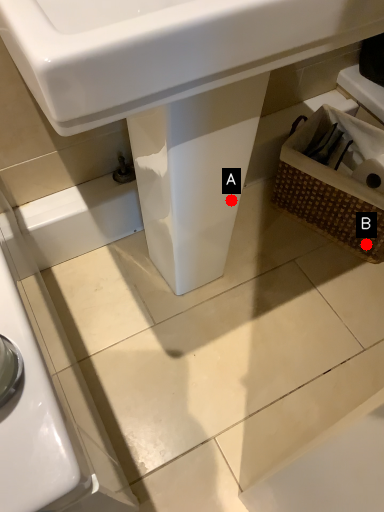
Question: Two points are circled on the image, labeled by A and B beside each circle. Which point is farther to the camera?

Choices:
 (A) A is further
 (B) B is further

Answer: (B)